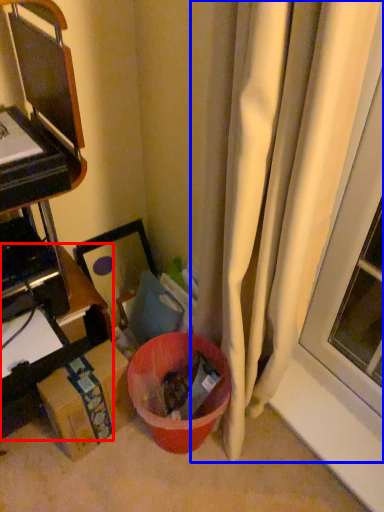
Question: Among these objects, which one is nearest to the camera, furniture (highlighted by a red box) or curtain (highlighted by a blue box)?

Choices:
 (A) furniture
 (B) curtain

Answer: (B)